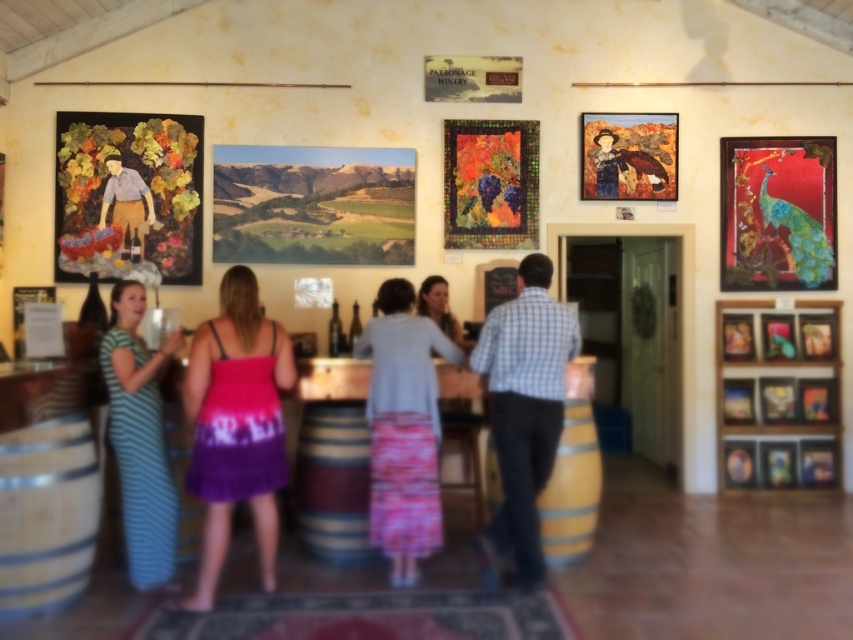
Question: Among these objects, which one is farthest from the camera?

Choices:
 (A) matte gray shirt at center
 (B) metallic gold picture frame at upper right
 (C) wooden barrel at lower left
 (D) matte wooden picture frame at center

Answer: (B)

Question: Is wooden barrel at lower left wider than blue striped dress at lower left?

Choices:
 (A) yes
 (B) no

Answer: (B)

Question: Based on their relative distances, which object is farther from the purple tie-dye dress at center?

Choices:
 (A) wooden barrel at lower left
 (B) light gray sweater at center
 (C) matte wooden picture frame at center

Answer: (C)

Question: Does metallic peacock painting at upper right appear on the left side of matte wooden picture frame at upper center?

Choices:
 (A) no
 (B) yes

Answer: (A)

Question: Which object is farther from the camera taking this photo?

Choices:
 (A) matte wooden picture frame at center
 (B) matte gray shirt at center
 (C) brown wooden barrel at center
 (D) blue plaid shirt at center

Answer: (A)

Question: Can you confirm if wooden barrel at lower left is wider than blue striped dress at lower left?

Choices:
 (A) yes
 (B) no

Answer: (B)